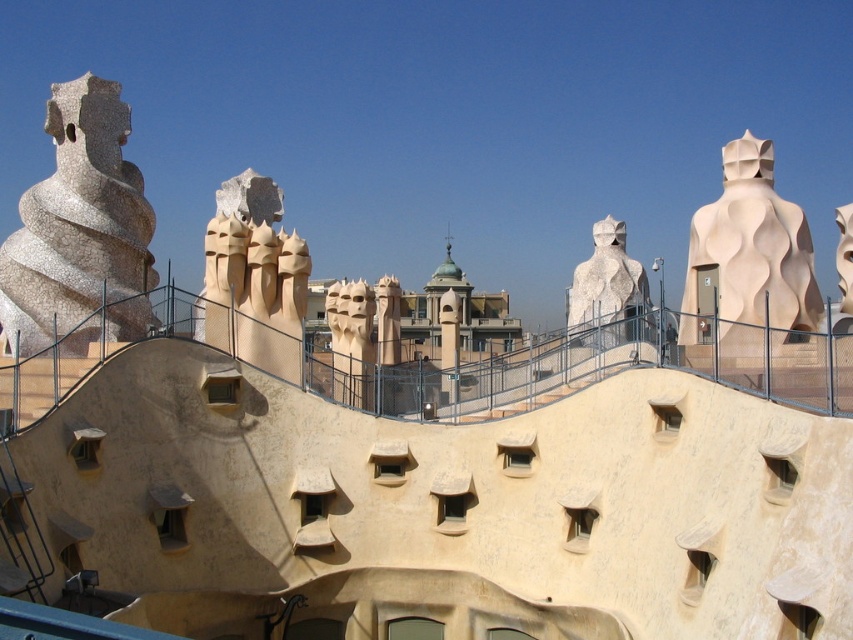
You are an art student analyzing the sculptures in the image. You see the white mosaic sculpture at left and the white textured sculpture at center. Which sculpture is located to the right of the other?

The white textured sculpture at center is to the right of the white mosaic sculpture at left.

You are an architect analyzing the building layout. Based on the scene, where is the beige textured sculpture at right positioned in relation to the smooth beige chimneys at center?

The beige textured sculpture at right is located below the smooth beige chimneys at center.